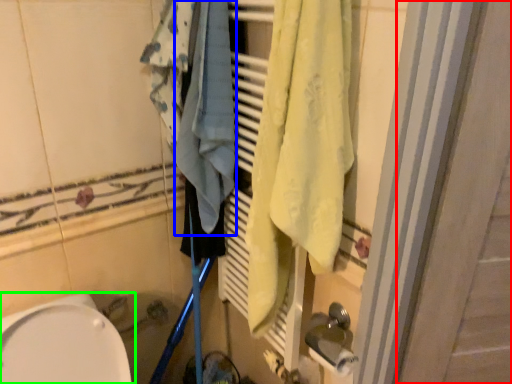
Question: Which object is the farthest from screen door (highlighted by a red box)? Choose among these: bath towel (highlighted by a blue box) or toilet (highlighted by a green box).

Choices:
 (A) bath towel
 (B) toilet

Answer: (B)